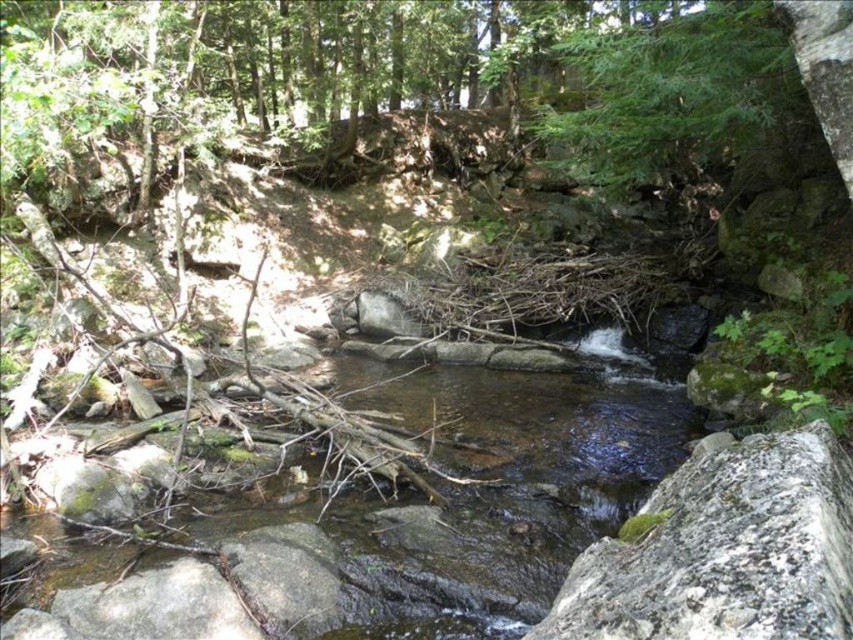
You are a hiker trying to cross the stream. You see the clear water at center and the green mossy rock at center. Which object is closer to you as you approach the stream?

The clear water at center is closer to you because the green mossy rock at center is behind it.

You are a hiker who wants to cross the stream safely. You see the clear water at center and the green leafy tree at upper right. Which object is closer to you as you stand on the riverbank?

The clear water at center is closer to you because it is in front of the green leafy tree at upper right, which is further back in the scene.

You are planning to cross the stream at the center of the image. The clear water at center is where you need to step. Considering the green leafy tree at upper right, which object is narrower in width?

The clear water at center has a lesser width compared to the green leafy tree at upper right, so the clear water at center is narrower.